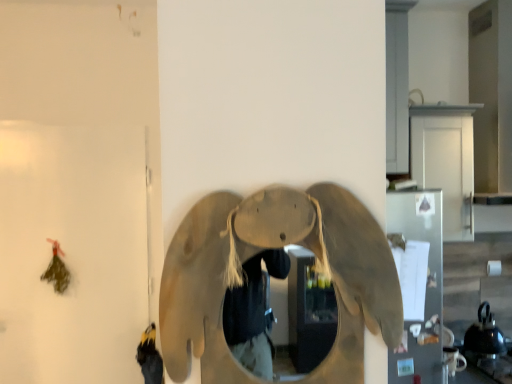
Describe the element at coordinates (269, 248) in the screenshot. This screenshot has width=512, height=384. I see `matte beige elephant at center` at that location.

Image resolution: width=512 pixels, height=384 pixels. In order to click on matte beige elephant at center in this screenshot , I will do [269, 248].

What is the approximate width of matte beige elephant at center?

It is 4.14 inches.

At what (x,y) coordinates should I click in order to perform the action: click on metallic silver refrigerator at right. Please return your answer as a coordinate pair (x, y). Looking at the image, I should click on (418, 283).

Describe the element at coordinates (418, 283) in the screenshot. The width and height of the screenshot is (512, 384). I see `metallic silver refrigerator at right` at that location.

Image resolution: width=512 pixels, height=384 pixels. What are the coordinates of `matte beige elephant at center` in the screenshot? It's located at (269, 248).

Is matte beige elephant at center to the left of metallic silver refrigerator at right from the viewer's perspective?

Correct, you'll find matte beige elephant at center to the left of metallic silver refrigerator at right.

Which object is further away from the camera taking this photo, matte beige elephant at center or metallic silver refrigerator at right?

metallic silver refrigerator at right is further from the camera.

Is point (234, 382) closer or farther from the camera than point (429, 218)?

Point (234, 382).

From the image's perspective, is matte beige elephant at center above metallic silver refrigerator at right?

Correct, matte beige elephant at center appears higher than metallic silver refrigerator at right in the image.

From a real-world perspective, relative to metallic silver refrigerator at right, is matte beige elephant at center vertically above or below?

matte beige elephant at center is situated higher than metallic silver refrigerator at right in the real world.

Is matte beige elephant at center thinner than metallic silver refrigerator at right?

Incorrect, the width of matte beige elephant at center is not less than that of metallic silver refrigerator at right.

Considering the sizes of matte beige elephant at center and metallic silver refrigerator at right in the image, is matte beige elephant at center taller or shorter than metallic silver refrigerator at right?

Clearly, matte beige elephant at center is shorter compared to metallic silver refrigerator at right.

In terms of size, does matte beige elephant at center appear bigger or smaller than metallic silver refrigerator at right?

Clearly, matte beige elephant at center is larger in size than metallic silver refrigerator at right.

Is matte beige elephant at center inside or outside of metallic silver refrigerator at right?

matte beige elephant at center exists outside the volume of metallic silver refrigerator at right.

Can you see matte beige elephant at center touching metallic silver refrigerator at right?

No, matte beige elephant at center is not in contact with metallic silver refrigerator at right.

Is matte beige elephant at center oriented away from metallic silver refrigerator at right?

No, metallic silver refrigerator at right is not at the back of matte beige elephant at center.

How different are the orientations of matte beige elephant at center and metallic silver refrigerator at right in degrees?

The facing directions of matte beige elephant at center and metallic silver refrigerator at right are 0.8 degrees apart.

Locate an element on the screen. The width and height of the screenshot is (512, 384). elephant above the metallic silver refrigerator at right (from a real-world perspective) is located at coordinates (269, 248).

Which is more to the right, metallic silver refrigerator at right or matte beige elephant at center?

From the viewer's perspective, metallic silver refrigerator at right appears more on the right side.

Between metallic silver refrigerator at right and matte beige elephant at center, which one is positioned in front?

matte beige elephant at center is in front.

Is point (386, 224) in front of point (342, 293)?

No, (386, 224) is further to viewer.

From the image's perspective, is metallic silver refrigerator at right located above or below matte beige elephant at center?

Clearly, from the image's perspective, metallic silver refrigerator at right is below matte beige elephant at center.

From a real-world perspective, is metallic silver refrigerator at right physically above matte beige elephant at center?

No.

Considering the relative sizes of metallic silver refrigerator at right and matte beige elephant at center in the image provided, is metallic silver refrigerator at right thinner than matte beige elephant at center?

Indeed, metallic silver refrigerator at right has a lesser width compared to matte beige elephant at center.

Considering the relative sizes of metallic silver refrigerator at right and matte beige elephant at center in the image provided, is metallic silver refrigerator at right taller than matte beige elephant at center?

Yes.

Considering the relative sizes of metallic silver refrigerator at right and matte beige elephant at center in the image provided, is metallic silver refrigerator at right smaller than matte beige elephant at center?

Yes.

Is metallic silver refrigerator at right inside the boundaries of matte beige elephant at center, or outside?

metallic silver refrigerator at right lies outside matte beige elephant at center.

Would you say metallic silver refrigerator at right is a long distance from matte beige elephant at center?

Actually, metallic silver refrigerator at right and matte beige elephant at center are a little close together.

Is metallic silver refrigerator at right turned away from matte beige elephant at center?

No, metallic silver refrigerator at right is not facing away from matte beige elephant at center.

How different are the orientations of metallic silver refrigerator at right and matte beige elephant at center in degrees?

0.8 degrees.

At what (x,y) coordinates should I click in order to perform the action: click on elephant on the left of metallic silver refrigerator at right. Please return your answer as a coordinate pair (x, y). The image size is (512, 384). Looking at the image, I should click on (269, 248).

At what (x,y) coordinates should I click in order to perform the action: click on appliance on the right of matte beige elephant at center. Please return your answer as a coordinate pair (x, y). The image size is (512, 384). Looking at the image, I should click on pos(418,283).

Locate an element on the screen. The image size is (512, 384). appliance behind the matte beige elephant at center is located at coordinates (418, 283).